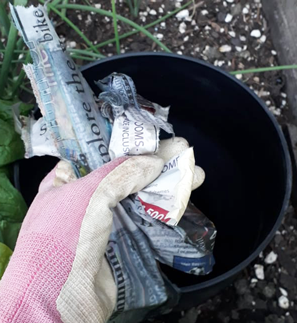
The width and height of the screenshot is (297, 323). I want to click on bucket, so click(268, 120).